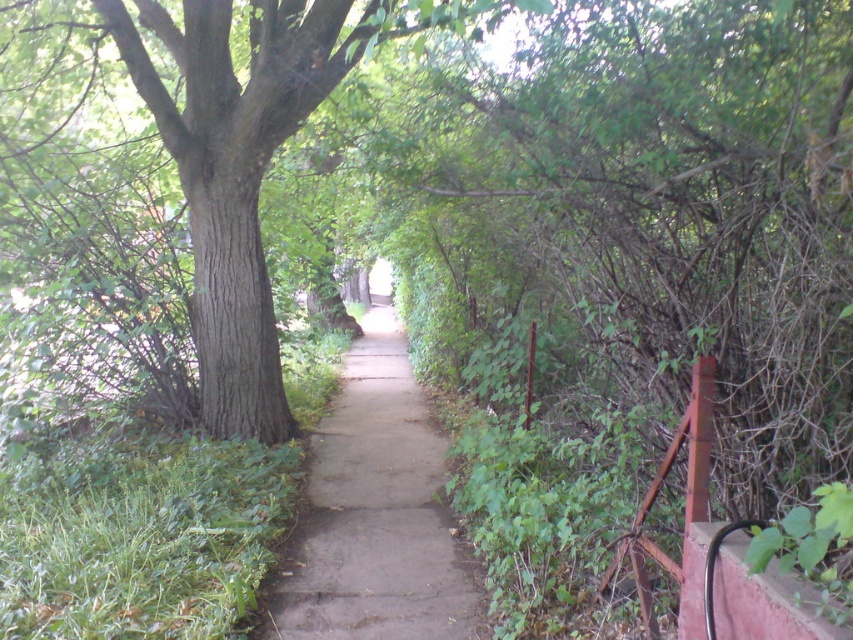
Question: Which point is farther from the camera taking this photo?

Choices:
 (A) (354, 436)
 (B) (204, 3)

Answer: (A)

Question: Does green rough bark tree at center have a lesser width compared to dull concrete pavement at center?

Choices:
 (A) no
 (B) yes

Answer: (A)

Question: Is green rough bark tree at center thinner than dull concrete pavement at center?

Choices:
 (A) no
 (B) yes

Answer: (A)

Question: Which object is closer to the camera taking this photo?

Choices:
 (A) green rough bark tree at center
 (B) dull concrete pavement at center

Answer: (B)

Question: Among these objects, which one is farthest from the camera?

Choices:
 (A) dull concrete pavement at center
 (B) green rough bark tree at center

Answer: (B)

Question: Considering the relative positions of green rough bark tree at center and dull concrete pavement at center in the image provided, where is green rough bark tree at center located with respect to dull concrete pavement at center?

Choices:
 (A) right
 (B) left

Answer: (B)